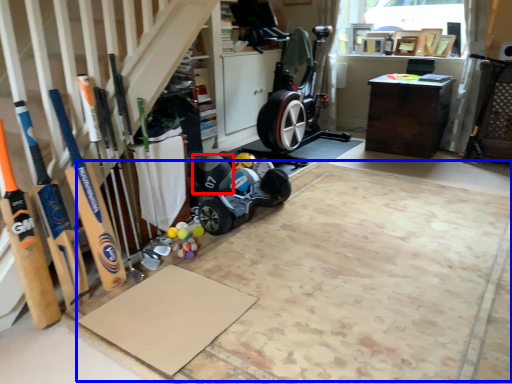
Question: Which object appears farthest to the camera in this image, sports equipment (highlighted by a red box) or yoga mat (highlighted by a blue box)?

Choices:
 (A) sports equipment
 (B) yoga mat

Answer: (A)